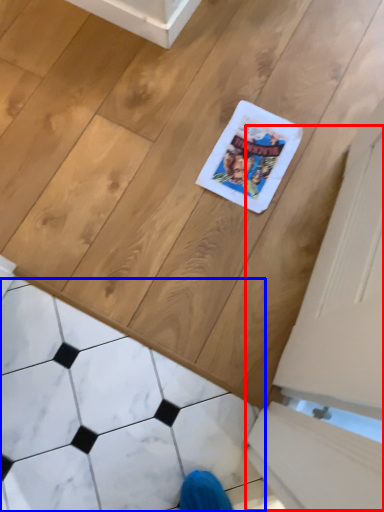
Question: Which object is closer to the camera taking this photo, screen door (highlighted by a red box) or marble (highlighted by a blue box)?

Choices:
 (A) screen door
 (B) marble

Answer: (B)